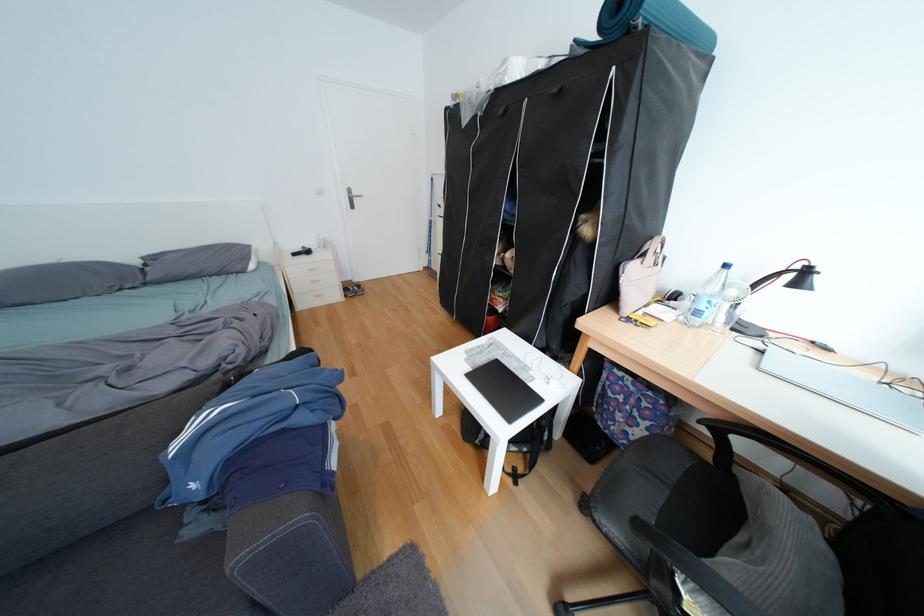
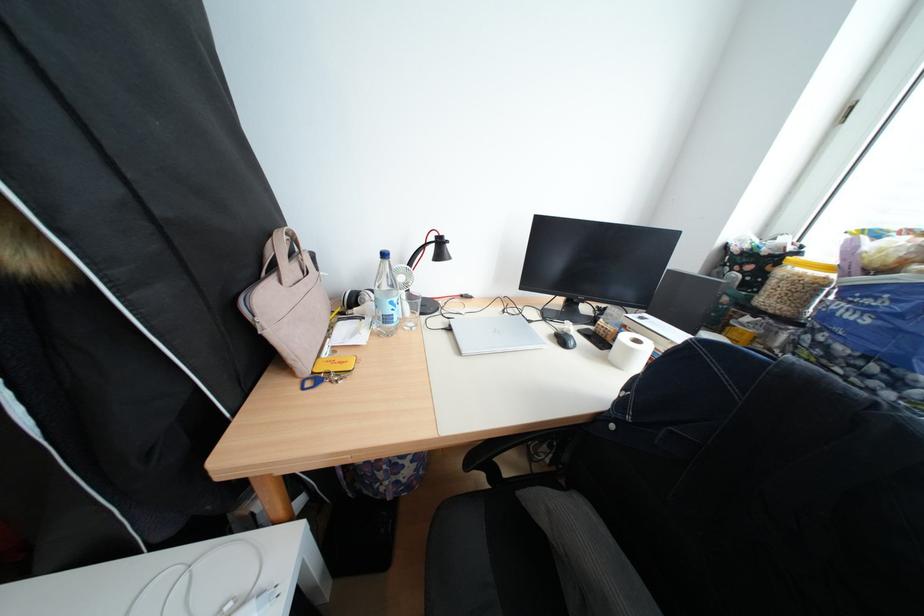
Based on the continuous images, in which direction is the camera rotating?

The camera rotated toward right-down.